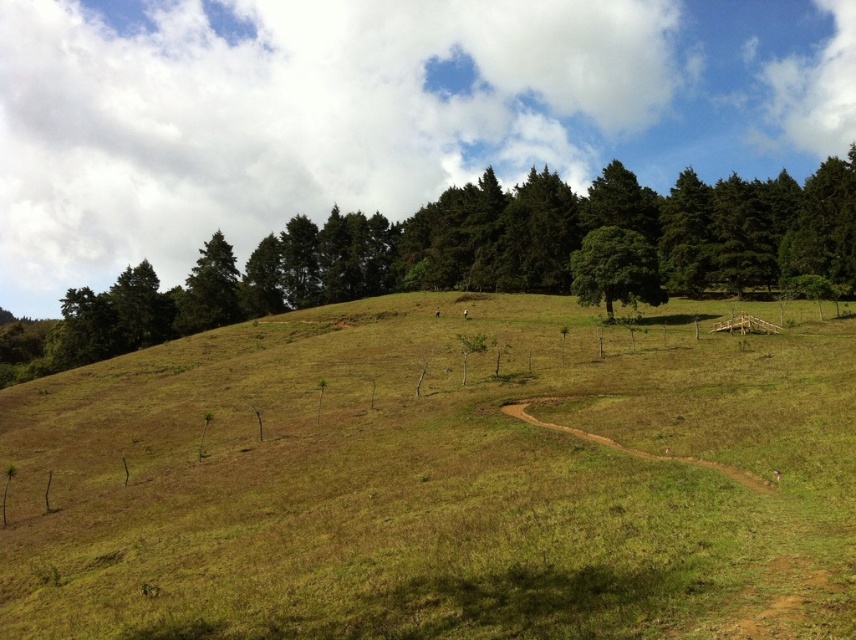
Question: Can you confirm if green leafy tree at upper center is positioned to the right of green leafy tree at center?

Choices:
 (A) yes
 (B) no

Answer: (B)

Question: Which of the following is the farthest from the observer?

Choices:
 (A) green grassy hillside at center
 (B) brown dirt trail at center

Answer: (B)

Question: Among these objects, which one is nearest to the camera?

Choices:
 (A) green leafy tree at upper center
 (B) brown dirt trail at center
 (C) green grassy hillside at center

Answer: (C)

Question: Which object is closer to the camera taking this photo?

Choices:
 (A) green leafy tree at center
 (B) brown dirt trail at center

Answer: (B)

Question: Considering the relative positions of green leafy tree at upper center and green leafy tree at center in the image provided, where is green leafy tree at upper center located with respect to green leafy tree at center?

Choices:
 (A) below
 (B) above

Answer: (B)

Question: Is green leafy tree at upper center below brown dirt trail at center?

Choices:
 (A) no
 (B) yes

Answer: (A)